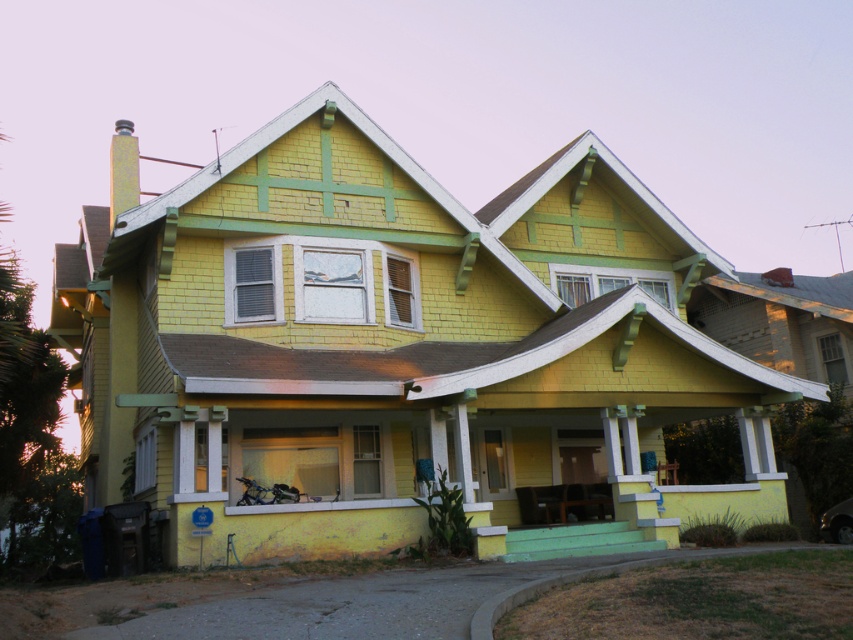
You are standing in front of the house and notice a specific point marked at coordinates (408, 348). Based on the scene description, what is the object located at that point?

The point at coordinates (408, 348) corresponds to the yellow shingles at center, which are part of the house exterior.

You are standing in front of the house and want to know where the yellow shingles at center are positioned relative to the front entrance. Can you determine their location based on the given coordinates?

The yellow shingles at center are located at coordinates point (408,348), which places them centrally on the house, likely near the middle of the front facade.